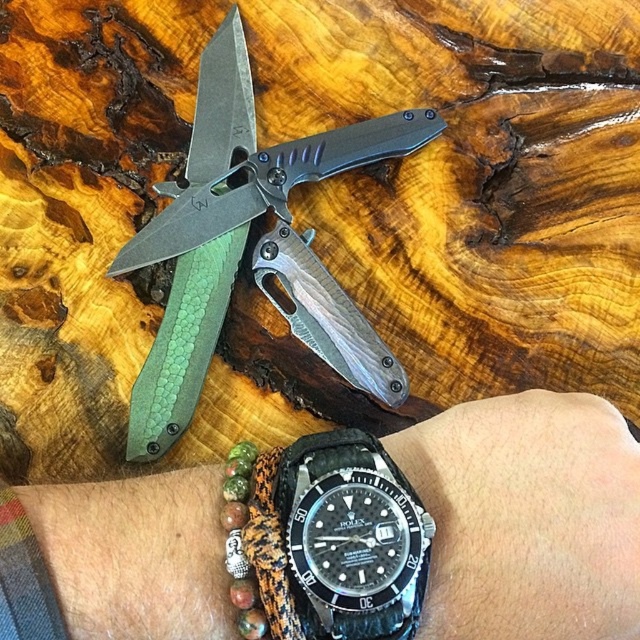
Does black leather watch at lower right appear on the right side of green textured knife at upper center?

Indeed, black leather watch at lower right is positioned on the right side of green textured knife at upper center.

Is black leather watch at lower right further to the viewer compared to green textured knife at upper center?

That is False.

Who is more distant from viewer, (513, 560) or (326, 140)?

The point (326, 140) is behind.

What are the coordinates of `black leather watch at lower right` in the screenshot? It's located at [x=528, y=516].

Can you confirm if black leather watch at lower right is wider than black rubber watch at lower center?

Indeed, black leather watch at lower right has a greater width compared to black rubber watch at lower center.

Who is more forward, (436, 419) or (317, 556)?

Point (317, 556)

Where is `black leather watch at lower right`? The width and height of the screenshot is (640, 640). black leather watch at lower right is located at coordinates 528,516.

I want to click on green textured knife at upper center, so click(x=253, y=246).

Does green textured knife at upper center appear on the right side of black rubber watch at lower center?

In fact, green textured knife at upper center is to the left of black rubber watch at lower center.

The image size is (640, 640). I want to click on green textured knife at upper center, so click(x=253, y=246).

Identify the location of green textured knife at upper center. (253, 246).